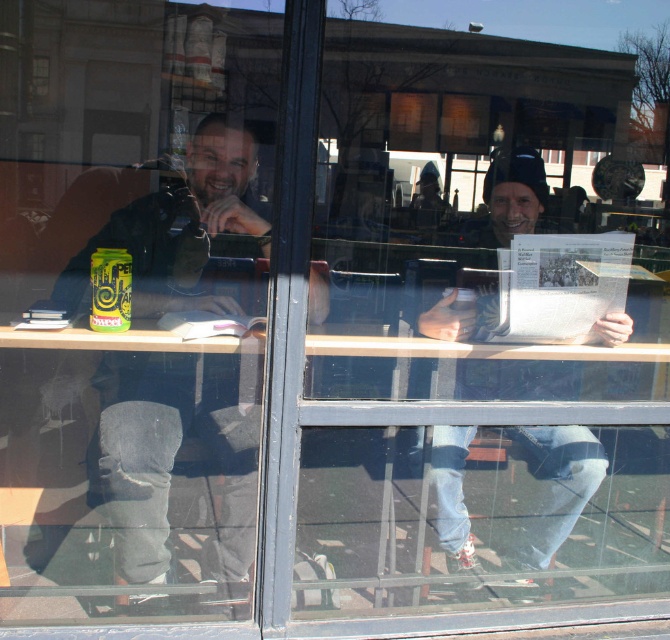
Question: Which object appears closest to the camera in this image?

Choices:
 (A) dark gray jeans at left
 (B) green matte soda can at center

Answer: (A)

Question: Which of the following is the closest to the observer?

Choices:
 (A) (92, 276)
 (B) (206, 273)

Answer: (A)

Question: Which of the following is the farthest from the observer?

Choices:
 (A) (531, 452)
 (B) (96, 269)
 (C) (129, 243)

Answer: (A)

Question: Can you confirm if dark gray jeans at left is thinner than white paper newspaper at center?

Choices:
 (A) no
 (B) yes

Answer: (A)

Question: Where is dark gray jeans at left located in relation to green matte soda can at center in the image?

Choices:
 (A) left
 (B) right

Answer: (B)

Question: Is dark gray jeans at left wider than white paper newspaper at center?

Choices:
 (A) no
 (B) yes

Answer: (B)